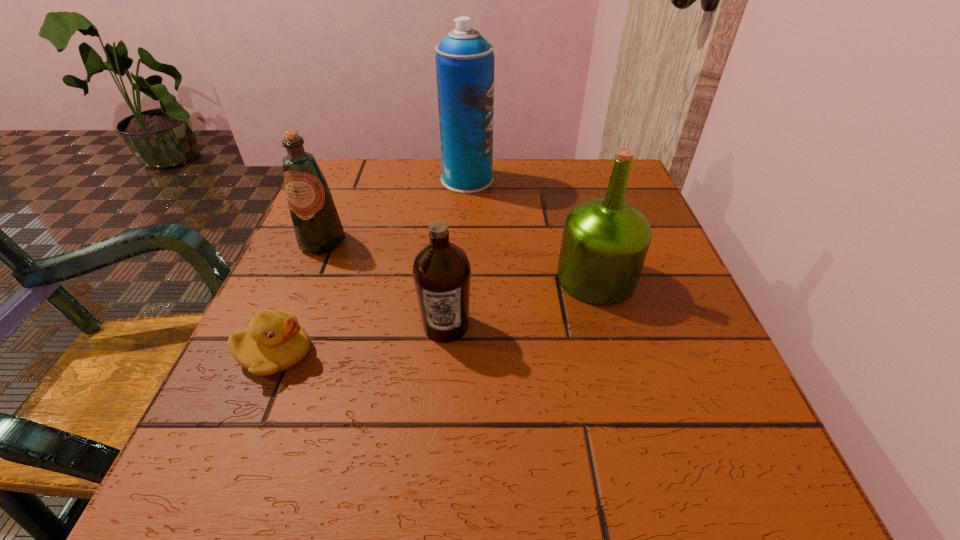
Locate an element on the screen. the tallest object is located at coordinates (464, 59).

In order to click on the farthest object in this screenshot , I will do `click(464, 59)`.

You are a GUI agent. You are given a task and a screenshot of the screen. Output one action in this format:
    pyautogui.click(x=<x>, y=<y>)
    Task: Click on the rightmost olive oil
    The width and height of the screenshot is (960, 540).
    Given the screenshot: What is the action you would take?
    pyautogui.click(x=605, y=241)

The width and height of the screenshot is (960, 540). Identify the location of the leftmost olive oil. (317, 225).

Locate an element on the screen. The image size is (960, 540). the second olive oil from left to right is located at coordinates pos(441,271).

Where is `the shortest object`? The image size is (960, 540). the shortest object is located at coordinates (274, 342).

You are a GUI agent. You are given a task and a screenshot of the screen. Output one action in this format:
    pyautogui.click(x=<x>, y=<y>)
    Task: Click on the free space located on the right of the farthest object
    The height and width of the screenshot is (540, 960).
    Given the screenshot: What is the action you would take?
    pyautogui.click(x=561, y=180)

Where is `blank area located on the left of the rightmost object`? blank area located on the left of the rightmost object is located at coordinates (338, 278).

Find the location of `free space located on the front-facing side of the leftmost olive oil`. free space located on the front-facing side of the leftmost olive oil is located at coordinates (282, 338).

Identify the location of vacant point located on the label of the second olive oil from left to right. (443, 373).